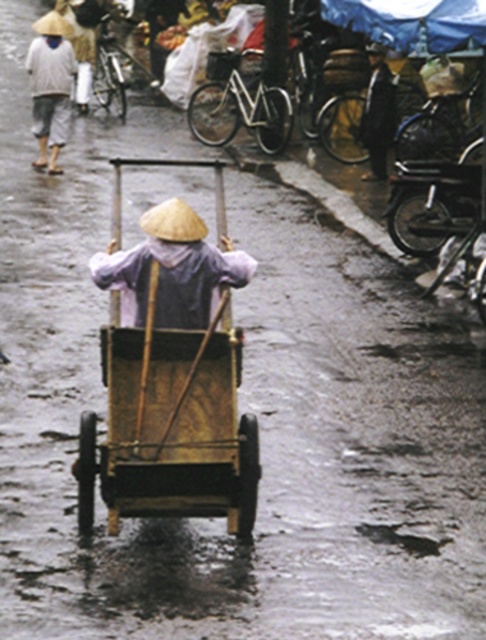
Can you confirm if wooden cart at center is positioned below white cotton shirt at upper left?

Yes.

This screenshot has width=486, height=640. In order to click on wooden cart at center in this screenshot , I will do `click(175, 371)`.

Can you confirm if wooden cart at center is wider than matte straw hat at center?

Incorrect, wooden cart at center's width does not surpass matte straw hat at center's.

Between wooden cart at center and matte straw hat at center, which one is positioned lower?

wooden cart at center is lower down.

Find the location of a particular element. The image size is (486, 640). wooden cart at center is located at coordinates (175, 371).

Does matte straw hat at center appear on the right side of white cotton shirt at upper left?

Yes, matte straw hat at center is to the right of white cotton shirt at upper left.

Where is `matte straw hat at center`? This screenshot has width=486, height=640. matte straw hat at center is located at coordinates (172, 269).

Identify the location of matte straw hat at center. (172, 269).